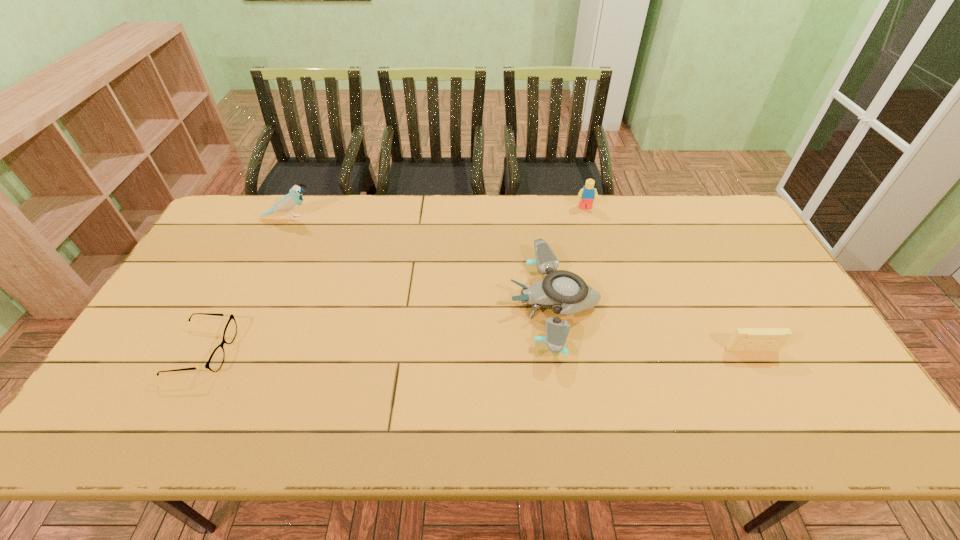
In the image, there is a desktop. At what (x,y) coordinates should I click in order to perform the action: click on vacant area at the far edge. Please return your answer as a coordinate pair (x, y). Looking at the image, I should click on (511, 205).

Locate an element on the screen. free space at the near edge is located at coordinates (655, 417).

At what (x,y) coordinates should I click in order to perform the action: click on free region at the left edge. Please return your answer as a coordinate pair (x, y). This screenshot has width=960, height=540. Looking at the image, I should click on (223, 264).

At what (x,y) coordinates should I click in order to perform the action: click on vacant area at the right edge. Please return your answer as a coordinate pair (x, y). This screenshot has width=960, height=540. Looking at the image, I should click on (804, 333).

You are a GUI agent. You are given a task and a screenshot of the screen. Output one action in this format:
    pyautogui.click(x=<x>, y=<y>)
    Task: Click on the free space at the far right corner of the desktop
    The image size is (960, 540).
    Given the screenshot: What is the action you would take?
    pyautogui.click(x=708, y=208)

Locate an element on the screen. The image size is (960, 540). vacant region at the near right corner is located at coordinates (823, 409).

Find the location of a particular element. The image size is (960, 540). unoccupied position between the second tallest object and the spectacles is located at coordinates (395, 280).

The height and width of the screenshot is (540, 960). I want to click on free space between the fourth nearest object and the farthest object, so pos(437,213).

You are a GUI agent. You are given a task and a screenshot of the screen. Output one action in this format:
    pyautogui.click(x=<x>, y=<y>)
    Task: Click on the free area in between the bird and the Lego
    
    Given the screenshot: What is the action you would take?
    pyautogui.click(x=437, y=213)

Where is `vacant point located between the videotape and the spectacles`? The height and width of the screenshot is (540, 960). vacant point located between the videotape and the spectacles is located at coordinates (477, 350).